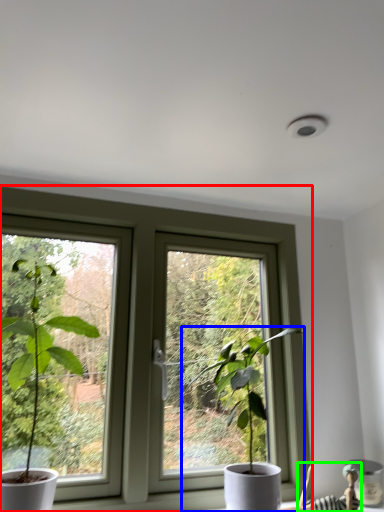
Question: Which object is positioned closest to window (highlighted by a red box)? Select from houseplant (highlighted by a blue box) and couple (highlighted by a green box).

Choices:
 (A) houseplant
 (B) couple

Answer: (A)